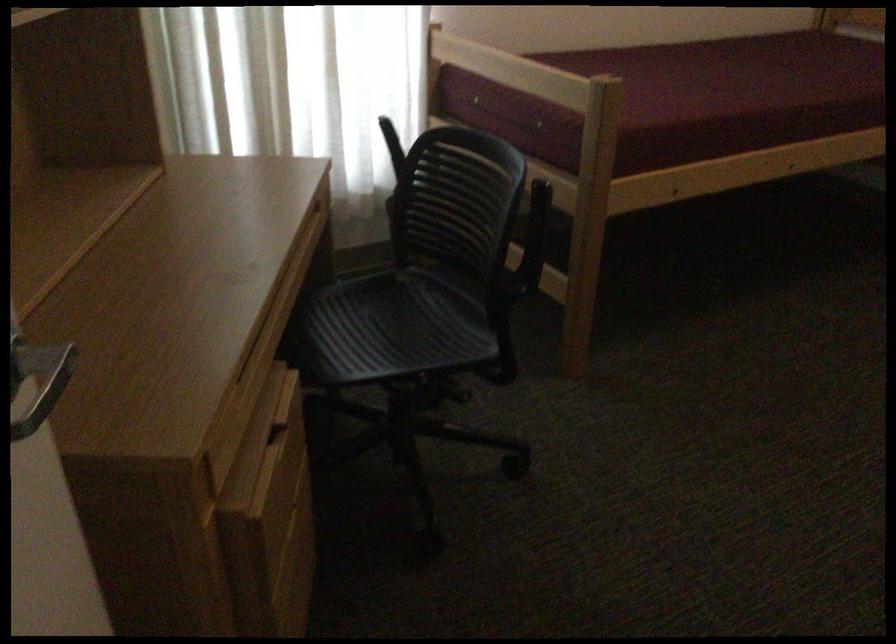
Describe the element at coordinates (536, 234) in the screenshot. This screenshot has width=896, height=644. I see `a black chair armrest` at that location.